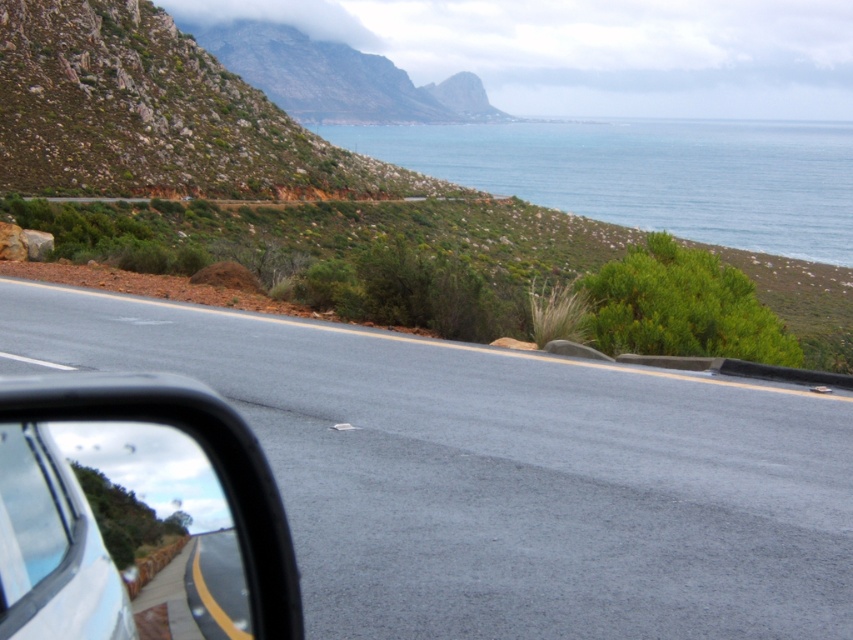
Question: Can you confirm if asphalt road at center is bigger than transparent glass car window at lower left?

Choices:
 (A) no
 (B) yes

Answer: (B)

Question: Can you confirm if asphalt road at center is bigger than blue water at upper right?

Choices:
 (A) no
 (B) yes

Answer: (A)

Question: Which object is closer to the camera taking this photo?

Choices:
 (A) black rubber side mirror at lower left
 (B) blue water at upper right

Answer: (A)

Question: Which point is farther to the camera?

Choices:
 (A) transparent glass car window at lower left
 (B) blue water at upper right

Answer: (B)

Question: Is asphalt road at center bigger than transparent glass car window at lower left?

Choices:
 (A) yes
 (B) no

Answer: (A)

Question: Which object is closer to the camera taking this photo?

Choices:
 (A) blue water at upper right
 (B) transparent glass car window at lower left
 (C) asphalt road at center

Answer: (B)